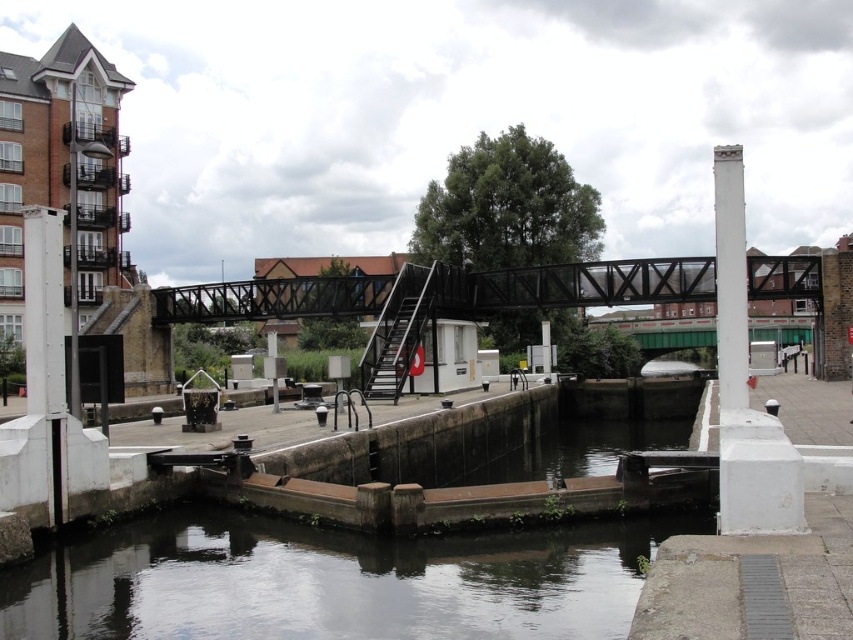
You are a boat operator trying to navigate through the canal lock. You see the dark gray concrete river at lower center and the black metal bridge at center. Which one is narrower in width?

The dark gray concrete river at lower center has a smaller size compared to black metal bridge at center, so the dark gray concrete river at lower center is narrower in width.

You are standing on the pedestrian bridge and want to cross to the other side. You notice the dark gray concrete river at lower center and the white concrete pillar at upper right. Which object is taller?

The white concrete pillar at upper right is taller than the dark gray concrete river at lower center.

You are standing at the point marked by coordinates point (331, 580) in the canal lock scene. What is the immediate surface you are standing on?

The immediate surface you are standing on is the dark gray concrete river at lower center, which is represented by point (331, 580).